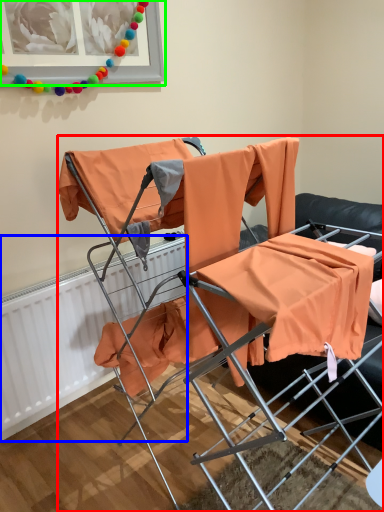
Question: Estimate the real-world distances between objects in this image. Which object is farther from chair (highlighted by a red box), radiator (highlighted by a blue box) or picture frame (highlighted by a green box)?

Choices:
 (A) radiator
 (B) picture frame

Answer: (B)